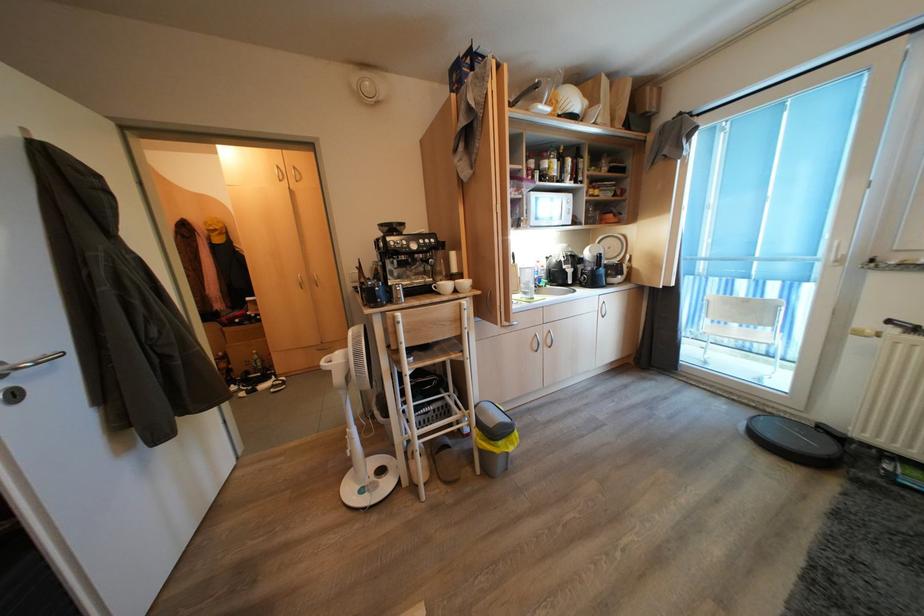
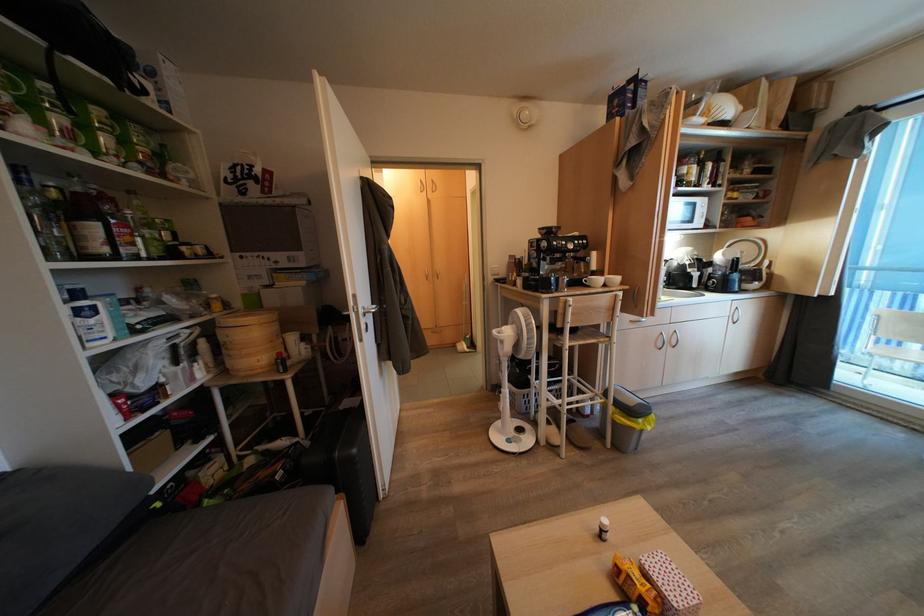
Where in the second image is the point corresponding to pixel 397 351 from the first image?

(564, 330)